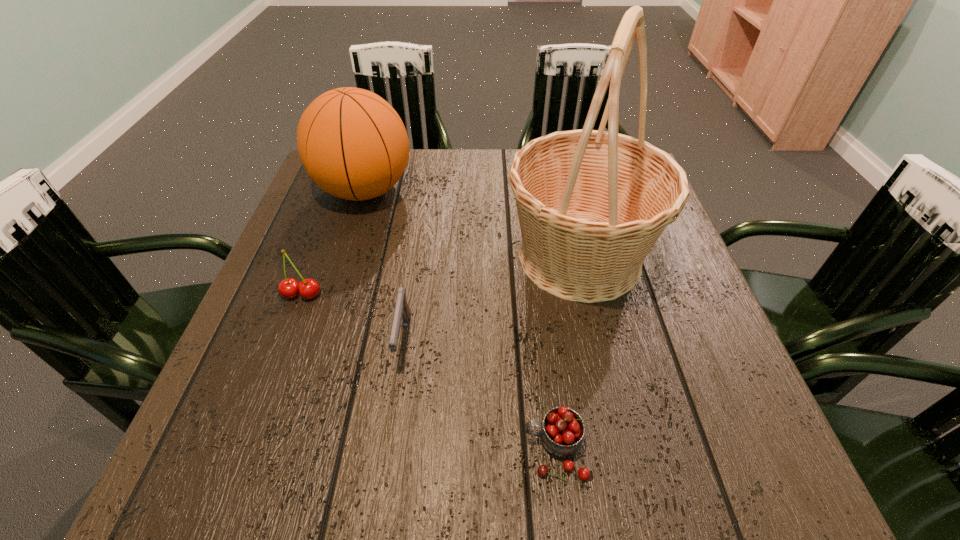
Identify the location of vacant area in the image that satisfies the following two spatial constraints: 1. on the front side of the basketball; 2. on the handle side of the nearest object. This screenshot has width=960, height=540. (283, 450).

Locate an element on the screen. This screenshot has height=540, width=960. free spot that satisfies the following two spatial constraints: 1. with the stems of the farther cherry pointing upwards; 2. on the handle side of the right cherry is located at coordinates (244, 450).

The width and height of the screenshot is (960, 540). Find the location of `vacant area that satisfies the following two spatial constraints: 1. with the stems of the farther cherry pointing upwards; 2. on the handle side of the nearest object`. vacant area that satisfies the following two spatial constraints: 1. with the stems of the farther cherry pointing upwards; 2. on the handle side of the nearest object is located at coordinates (244, 450).